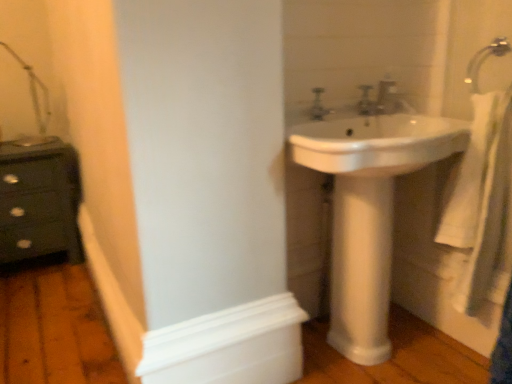
Question: Does dark green wooden chest of drawers at left appear on the left side of matte silver faucet at upper center, the 2th plumbing fixture viewed from the right?

Choices:
 (A) yes
 (B) no

Answer: (A)

Question: Is dark green wooden chest of drawers at left with matte silver faucet at upper center, the 1th plumbing fixture viewed from the left?

Choices:
 (A) no
 (B) yes

Answer: (A)

Question: From a real-world perspective, is dark green wooden chest of drawers at left over matte silver faucet at upper center, the 2th plumbing fixture viewed from the right?

Choices:
 (A) yes
 (B) no

Answer: (B)

Question: Is dark green wooden chest of drawers at left at the right side of matte silver faucet at upper center, the 1th plumbing fixture viewed from the left?

Choices:
 (A) yes
 (B) no

Answer: (B)

Question: Would you say dark green wooden chest of drawers at left is a long distance from matte silver faucet at upper center, the 1th plumbing fixture viewed from the left?

Choices:
 (A) yes
 (B) no

Answer: (A)

Question: Does dark green wooden chest of drawers at left have a greater height compared to matte silver faucet at upper center, the 2th plumbing fixture viewed from the right?

Choices:
 (A) no
 (B) yes

Answer: (B)

Question: Could you tell me if dark green wooden chest of drawers at left is facing silver metallic faucet at upper right?

Choices:
 (A) yes
 (B) no

Answer: (B)

Question: Can you see dark green wooden chest of drawers at left touching silver metallic faucet at upper right?

Choices:
 (A) yes
 (B) no

Answer: (B)

Question: Is dark green wooden chest of drawers at left to the left of silver metallic faucet at upper right from the viewer's perspective?

Choices:
 (A) yes
 (B) no

Answer: (A)

Question: Can you confirm if dark green wooden chest of drawers at left is thinner than silver metallic faucet at upper right?

Choices:
 (A) no
 (B) yes

Answer: (A)

Question: Considering the relative sizes of dark green wooden chest of drawers at left and silver metallic faucet at upper right in the image provided, is dark green wooden chest of drawers at left taller than silver metallic faucet at upper right?

Choices:
 (A) no
 (B) yes

Answer: (B)

Question: Is dark green wooden chest of drawers at left oriented away from silver metallic faucet at upper right?

Choices:
 (A) no
 (B) yes

Answer: (A)

Question: Would you say silver metallic faucet at upper right is part of satin nickel faucet at upper right, placed as the first plumbing fixture when sorted from right to left,'s contents?

Choices:
 (A) no
 (B) yes

Answer: (A)